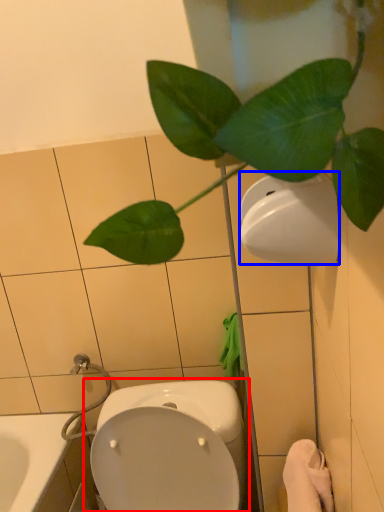
Question: Which object appears farthest to the camera in this image, toilet (highlighted by a red box) or toilet paper (highlighted by a blue box)?

Choices:
 (A) toilet
 (B) toilet paper

Answer: (A)